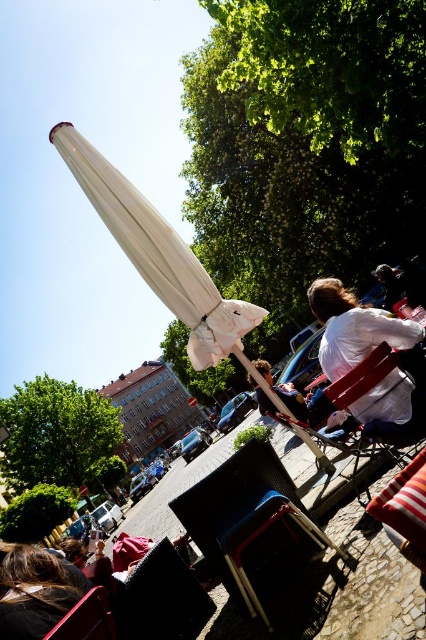
You are a customer at the outdoor cafe and want to place your small handbag between the black textured cushion at lower center and the matte pink shirt at lower left. Can the handbag fit in the space between them?

The black textured cushion at lower center is 68.99 centimeters away from the matte pink shirt at lower left. If the handbag is small enough to fit within this distance, it should be possible to place it there.

You are sitting at the matte black chair at lower left and want to move to the black textured cushion at lower center. Which direction should you move to reach it?

You should move to your right to reach the black textured cushion at lower center because it is positioned to the right of the matte black chair at lower left.